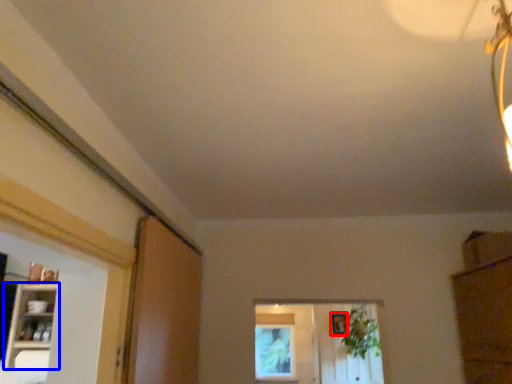
Question: Which point is closer to the camera, picture frame (highlighted by a red box) or shelf (highlighted by a blue box)?

Choices:
 (A) picture frame
 (B) shelf

Answer: (B)